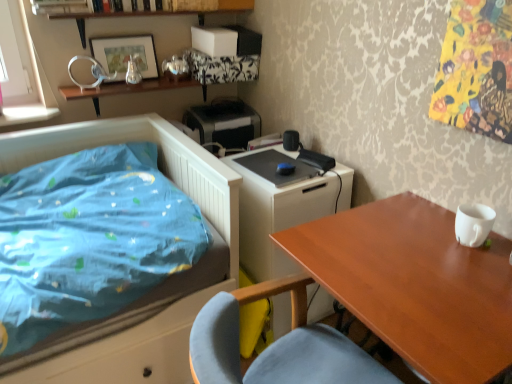
Question: Considering the positions of wooden table at right and black plastic printer at upper center in the image, is wooden table at right taller or shorter than black plastic printer at upper center?

Choices:
 (A) short
 (B) tall

Answer: (B)

Question: Looking at the image, does wooden table at right seem bigger or smaller compared to black plastic printer at upper center?

Choices:
 (A) small
 (B) big

Answer: (B)

Question: Estimate the real-world distances between objects in this image. Which object is farther from the wooden table at right?

Choices:
 (A) metallic silver picture frame at upper left
 (B) black plastic printer at upper center
 (C) blue fabric bed at left
 (D) white glossy changing table at center

Answer: (A)

Question: Based on their relative distances, which object is nearer to the wooden table at right?

Choices:
 (A) black plastic printer at upper center
 (B) metallic silver picture frame at upper left
 (C) white glossy changing table at center
 (D) blue fabric bed at left

Answer: (C)